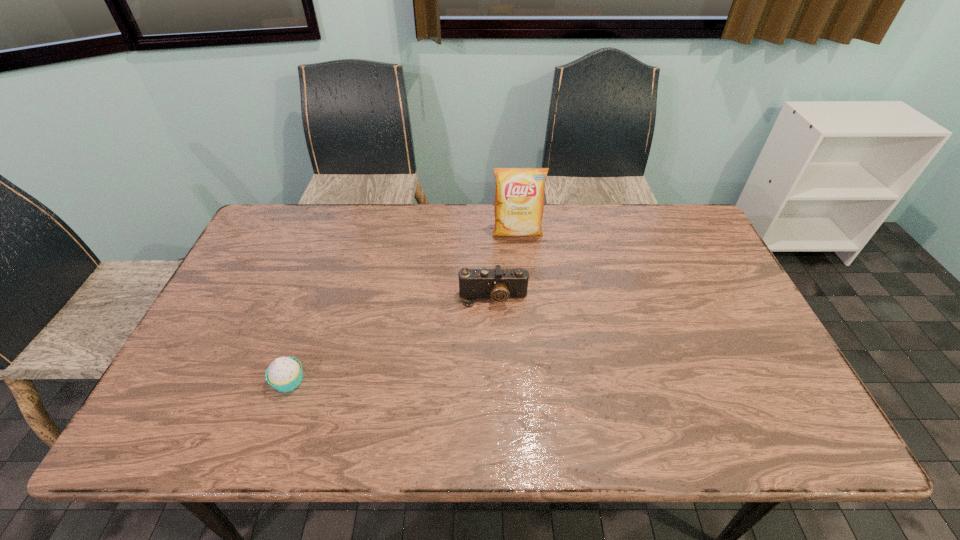
Locate an element on the screen. The image size is (960, 540). free spot at the right edge of the desktop is located at coordinates (764, 396).

This screenshot has width=960, height=540. In the image, there is a desktop. Identify the location of vacant space at the far left corner. (282, 216).

You are a GUI agent. You are given a task and a screenshot of the screen. Output one action in this format:
    pyautogui.click(x=<x>, y=<y>)
    Task: Click on the vacant point at the near left corner
    The image size is (960, 540).
    Given the screenshot: What is the action you would take?
    pyautogui.click(x=212, y=410)

In order to click on vacant space at the far right corner of the desktop in this screenshot , I will do `click(655, 237)`.

At what (x,y) coordinates should I click in order to perform the action: click on vacant space at the near right corner of the desktop. Please return your answer as a coordinate pair (x, y). Looking at the image, I should click on (751, 439).

Find the location of a particular element. The image size is (960, 540). vacant space that's between the leftmost object and the crisp (potato chip) is located at coordinates (403, 307).

What are the coordinates of `vacant space in between the camera and the nearest object` in the screenshot? It's located at (391, 339).

This screenshot has height=540, width=960. I want to click on empty space between the crisp (potato chip) and the cupcake, so click(x=403, y=307).

You are a GUI agent. You are given a task and a screenshot of the screen. Output one action in this format:
    pyautogui.click(x=<x>, y=<y>)
    Task: Click on the unoccupied position between the crisp (potato chip) and the nearest object
    The image size is (960, 540).
    Given the screenshot: What is the action you would take?
    pyautogui.click(x=403, y=307)

The width and height of the screenshot is (960, 540). Find the location of `unoccupied area between the nearest object and the camera`. unoccupied area between the nearest object and the camera is located at coordinates (391, 339).